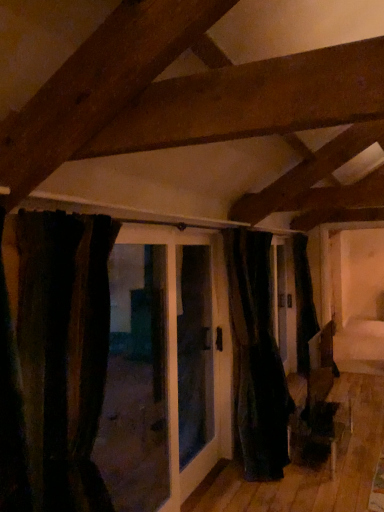
Question: Is black fabric door at center taller or shorter than dark velvet curtain at left, which appears as the second curtain when viewed from the back?

Choices:
 (A) short
 (B) tall

Answer: (B)

Question: Considering the positions of black fabric door at center and dark velvet curtain at left, the 2th curtain from the right, in the image, is black fabric door at center bigger or smaller than dark velvet curtain at left, the 2th curtain from the right,?

Choices:
 (A) big
 (B) small

Answer: (A)

Question: Which of these objects is positioned closest to the black velvet curtain at center, marked as the 1th curtain in a back-to-front arrangement?

Choices:
 (A) dark velvet curtain at left, which ranks as the first curtain in left-to-right order
 (B) black fabric door at center

Answer: (B)

Question: Estimate the real-world distances between objects in this image. Which object is farther from the black velvet curtain at center, which is the first curtain in right-to-left order?

Choices:
 (A) black fabric door at center
 (B) dark velvet curtain at left, the 2th curtain from the right

Answer: (B)